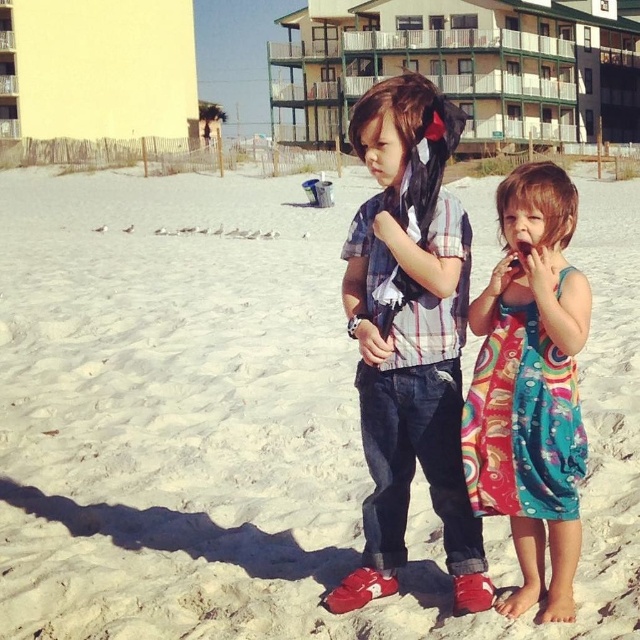
Question: Is the position of white sand at center more distant than that of plaid cotton shirt at center?

Choices:
 (A) no
 (B) yes

Answer: (B)

Question: Which object is the closest to the green wooden balcony at upper center?

Choices:
 (A) yellow painted building at upper left
 (B) white sand at center

Answer: (A)

Question: Does green wooden balcony at upper center appear on the right side of multicolored fabric dress at right?

Choices:
 (A) yes
 (B) no

Answer: (A)

Question: Which point appears farthest from the camera in this image?

Choices:
 (A) (76, 36)
 (B) (577, 291)
 (C) (456, 548)

Answer: (A)

Question: Can you confirm if white sand at center is bigger than multicolored fabric dress at right?

Choices:
 (A) yes
 (B) no

Answer: (A)

Question: Which object is the closest to the plaid cotton shirt at center?

Choices:
 (A) green wooden balcony at upper center
 (B) white sand at center
 (C) multicolored fabric dress at right
 (D) yellow painted building at upper left

Answer: (C)